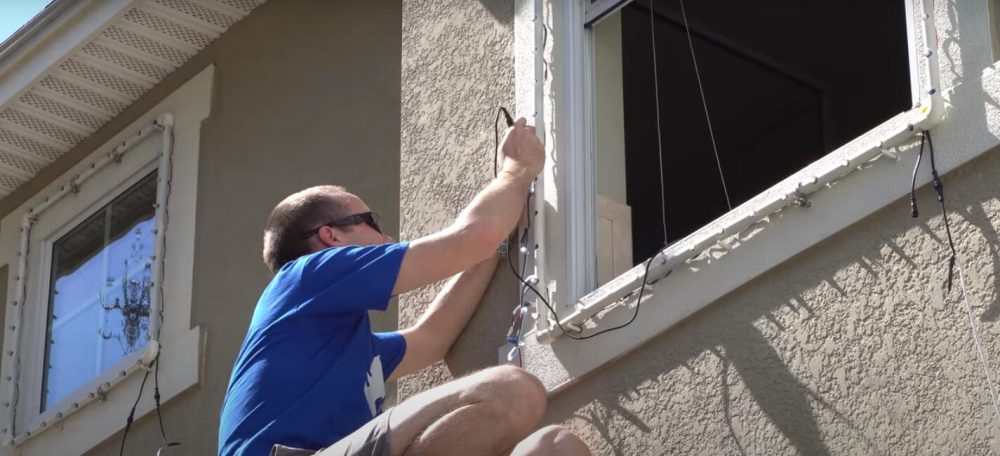
This screenshot has width=1000, height=456. Identify the location of frame. (154, 302).